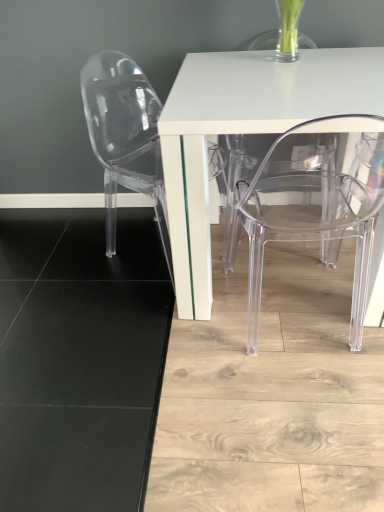
Image resolution: width=384 pixels, height=512 pixels. I want to click on vacant area that is in front of white glossy table at center, so (244, 410).